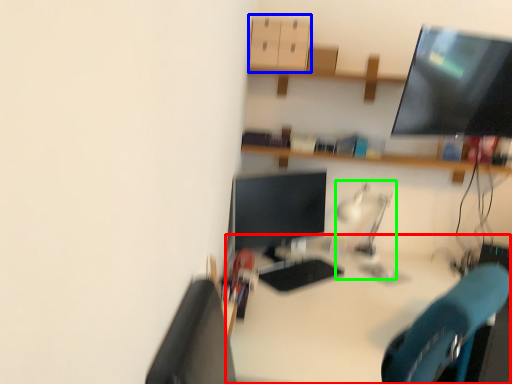
Question: Which is farther away from desk (highlighted by a red box)? drawer (highlighted by a blue box) or table lamp (highlighted by a green box)?

Choices:
 (A) drawer
 (B) table lamp

Answer: (A)